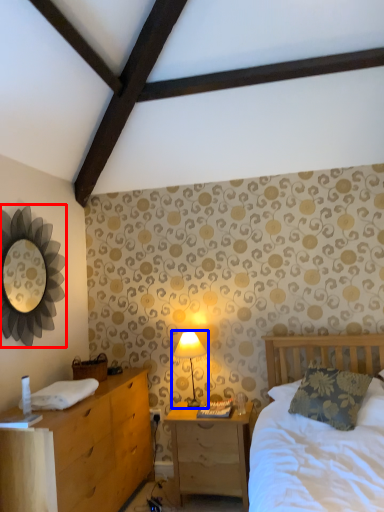
Question: Which object appears farthest to the camera in this image, mirror (highlighted by a red box) or table lamp (highlighted by a blue box)?

Choices:
 (A) mirror
 (B) table lamp

Answer: (B)